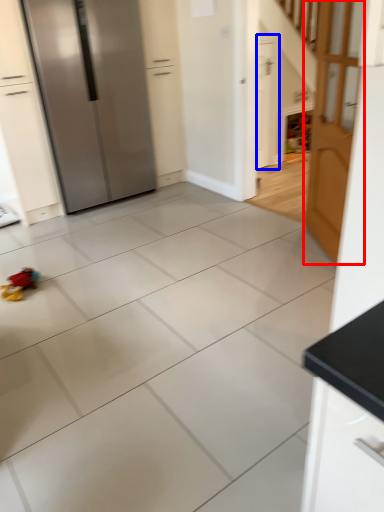
Question: Which object is further to the camera taking this photo, door (highlighted by a red box) or door (highlighted by a blue box)?

Choices:
 (A) door
 (B) door

Answer: (B)